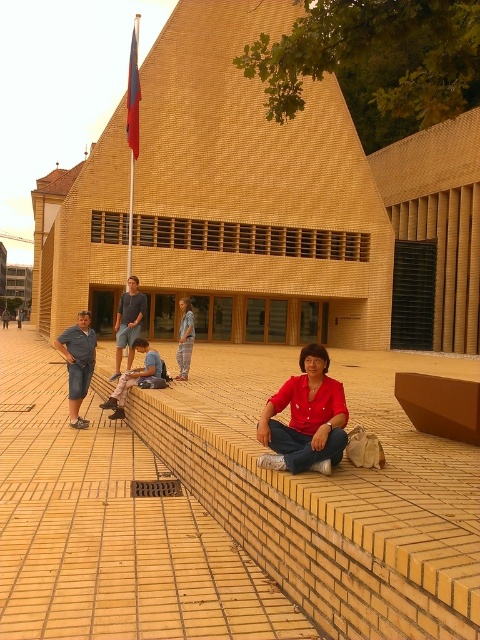
Who is more distant from viewer, (94, 332) or (131, 104)?

The point (131, 104) is more distant.

Is the position of denim shorts at left more distant than that of polished metal flag pole at center?

No, it is in front of polished metal flag pole at center.

Locate an element on the screen. denim shorts at left is located at coordinates (78, 364).

Is denim shorts at left shorter than denim pants at center?

Yes.

Does denim shorts at left appear on the left side of denim pants at center?

Indeed, denim shorts at left is positioned on the left side of denim pants at center.

Which is in front, point (70, 406) or point (180, 358)?

Point (70, 406) is in front.

This screenshot has width=480, height=640. What are the coordinates of `denim shorts at left` in the screenshot? It's located at (x=78, y=364).

Can you confirm if polished metal flag pole at center is positioned to the right of denim pants at center?

In fact, polished metal flag pole at center is to the left of denim pants at center.

Between point (130, 173) and point (187, 300), which one is positioned behind?

Positioned behind is point (130, 173).

Which is behind, point (130, 269) or point (187, 364)?

Point (130, 269)

This screenshot has height=640, width=480. I want to click on polished metal flag pole at center, so click(132, 128).